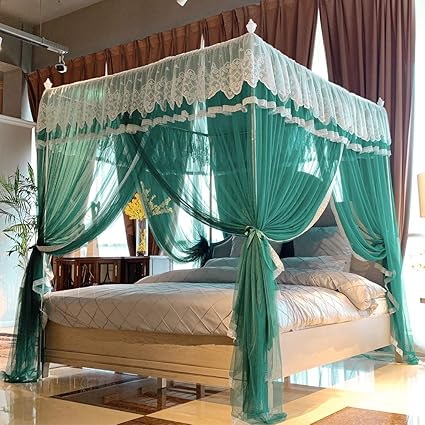
Locate an element on the screen. Image resolution: width=425 pixels, height=425 pixels. head rest is located at coordinates (323, 219).